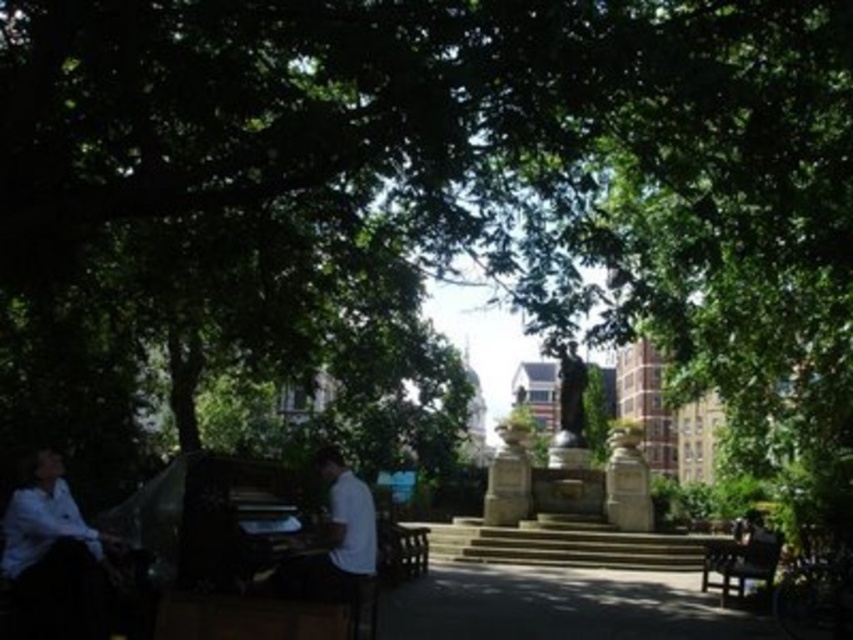
Question: Which object is the closest to the white matte shirt at lower left?

Choices:
 (A) dark brown wooden bench at lower right
 (B) white matte shirt at center

Answer: (B)

Question: Which is farther from the dark brown wooden bench at lower right?

Choices:
 (A) white matte shirt at lower left
 (B) white matte shirt at center

Answer: (A)

Question: From the image, what is the correct spatial relationship of white matte shirt at lower left in relation to dark brown wooden bench at lower right?

Choices:
 (A) above
 (B) below

Answer: (A)

Question: Can you confirm if white matte shirt at lower left is wider than dark brown wooden bench at lower right?

Choices:
 (A) no
 (B) yes

Answer: (B)

Question: Estimate the real-world distances between objects in this image. Which object is closer to the white matte shirt at center?

Choices:
 (A) white matte shirt at lower left
 (B) dark brown wooden bench at lower right

Answer: (A)

Question: Does white matte shirt at center have a larger size compared to dark brown wooden bench at lower right?

Choices:
 (A) no
 (B) yes

Answer: (A)